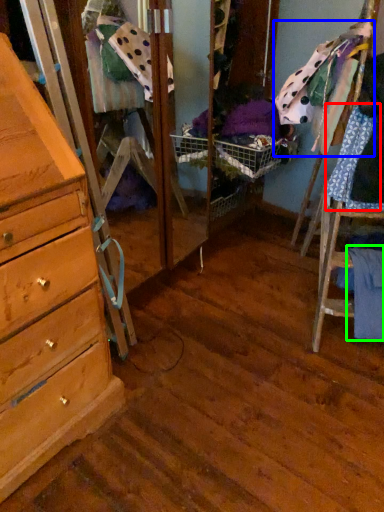
Question: Which object is the farthest from clothing (highlighted by a red box)? Choose among these: clothing (highlighted by a blue box) or clothing (highlighted by a green box).

Choices:
 (A) clothing
 (B) clothing

Answer: (B)